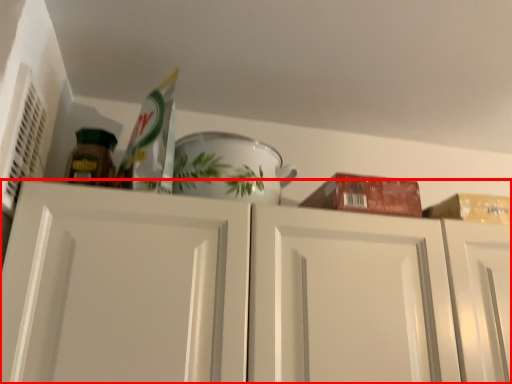
Question: From the image, what is the correct spatial relationship of cabinetry (annotated by the red box) in relation to tableware?

Choices:
 (A) right
 (B) left

Answer: (A)